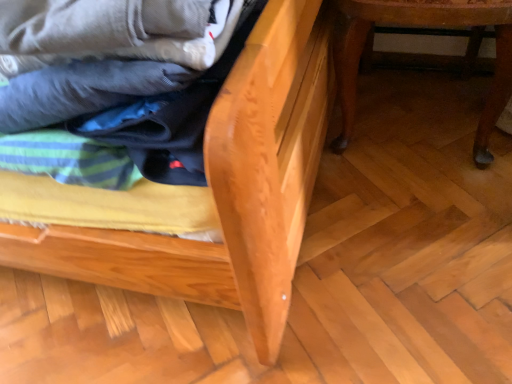
Question: Is natural wood bed frame at center, positioned as the 1th furniture in left-to-right order, shorter than matte cotton laundry at center?

Choices:
 (A) no
 (B) yes

Answer: (A)

Question: Considering the relative positions of natural wood bed frame at center, positioned as the 1th furniture in left-to-right order, and matte cotton laundry at center in the image provided, is natural wood bed frame at center, positioned as the 1th furniture in left-to-right order, to the right of matte cotton laundry at center from the viewer's perspective?

Choices:
 (A) yes
 (B) no

Answer: (B)

Question: Considering the relative sizes of natural wood bed frame at center, which is the 2th furniture in right-to-left order, and matte cotton laundry at center in the image provided, is natural wood bed frame at center, which is the 2th furniture in right-to-left order, smaller than matte cotton laundry at center?

Choices:
 (A) no
 (B) yes

Answer: (A)

Question: Would you say natural wood bed frame at center, positioned as the 1th furniture in left-to-right order, contains matte cotton laundry at center?

Choices:
 (A) no
 (B) yes

Answer: (B)

Question: Is natural wood bed frame at center, positioned as the 1th furniture in left-to-right order, facing away from matte cotton laundry at center?

Choices:
 (A) no
 (B) yes

Answer: (A)

Question: Is the position of natural wood bed frame at center, which is the 2th furniture in right-to-left order, less distant than that of matte cotton laundry at center?

Choices:
 (A) yes
 (B) no

Answer: (A)

Question: Considering the relative sizes of wooden table at lower right, arranged as the 1th furniture when viewed from the right, and matte cotton laundry at center in the image provided, is wooden table at lower right, arranged as the 1th furniture when viewed from the right, bigger than matte cotton laundry at center?

Choices:
 (A) no
 (B) yes

Answer: (B)

Question: Is there a large distance between wooden table at lower right, arranged as the 1th furniture when viewed from the right, and matte cotton laundry at center?

Choices:
 (A) no
 (B) yes

Answer: (A)

Question: From a real-world perspective, is wooden table at lower right, arranged as the 1th furniture when viewed from the right, located higher than matte cotton laundry at center?

Choices:
 (A) no
 (B) yes

Answer: (A)

Question: From a real-world perspective, is wooden table at lower right, which ranks as the second furniture in left-to-right order, under matte cotton laundry at center?

Choices:
 (A) yes
 (B) no

Answer: (A)

Question: Is wooden table at lower right, arranged as the 1th furniture when viewed from the right, in front of matte cotton laundry at center?

Choices:
 (A) no
 (B) yes

Answer: (A)

Question: Is wooden table at lower right, arranged as the 1th furniture when viewed from the right, oriented towards matte cotton laundry at center?

Choices:
 (A) yes
 (B) no

Answer: (B)

Question: Is matte cotton laundry at center further to camera compared to natural wood bed frame at center, which is the 2th furniture in right-to-left order?

Choices:
 (A) yes
 (B) no

Answer: (A)